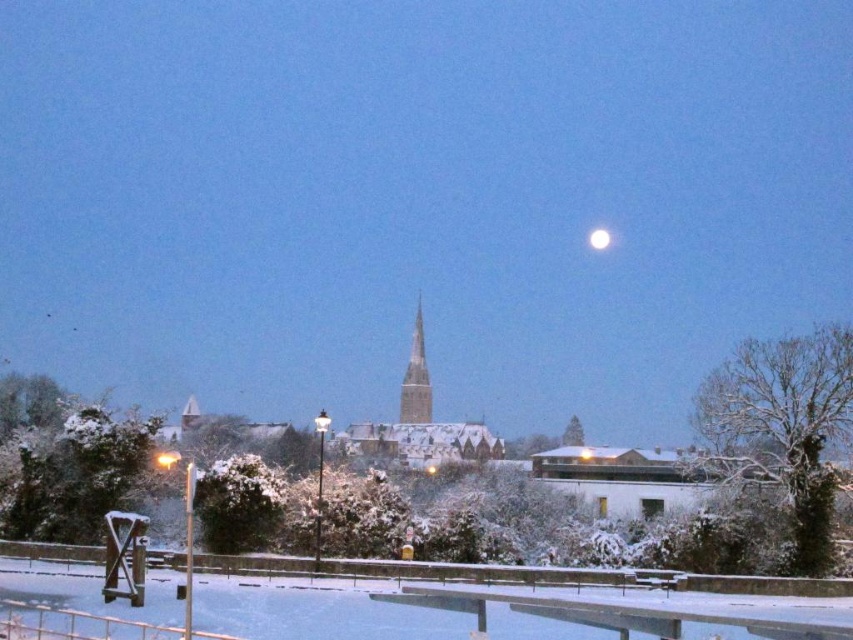
You are an astronomer observing the night sky and notice the smooth stone spire at center and the white glossy moon at upper center. Based on their positions, which object is closer to the left side of the sky?

The smooth stone spire at center is to the left of the white glossy moon at upper center, so it is closer to the left side of the sky.